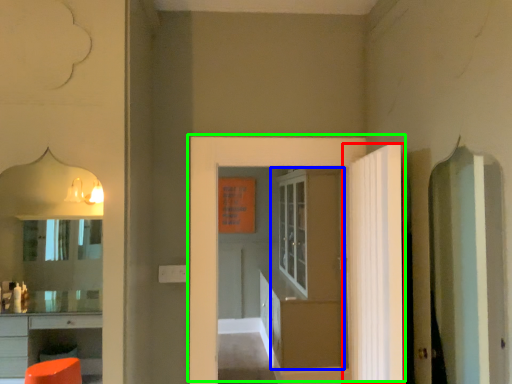
Question: Which is nearer to the door (highlighted by a red box)? door (highlighted by a blue box) or door (highlighted by a green box).

Choices:
 (A) door
 (B) door

Answer: (B)